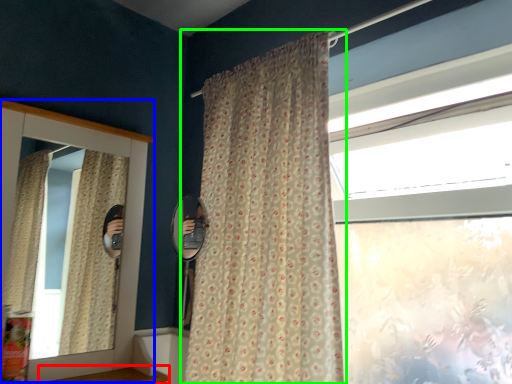
Question: Considering the real-world distances, which object is closest to window sill (highlighted by a red box)? medicine cabinet (highlighted by a blue box) or curtain (highlighted by a green box).

Choices:
 (A) medicine cabinet
 (B) curtain

Answer: (A)